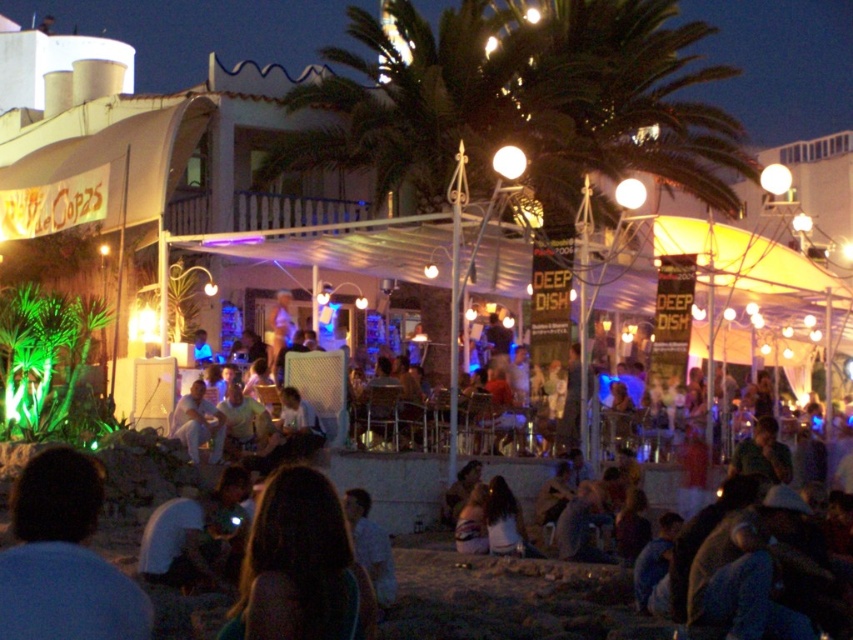
Question: Does blue fabric shirt at lower left have a larger size compared to dark brown hair at center?

Choices:
 (A) yes
 (B) no

Answer: (A)

Question: Which object is closer to the camera taking this photo?

Choices:
 (A) blue fabric shirt at lower left
 (B) dark brown hair at center

Answer: (A)

Question: Among these points, which one is farthest from the camera?

Choices:
 (A) (262, 604)
 (B) (36, 628)

Answer: (A)

Question: Which of the following is the farthest from the observer?

Choices:
 (A) blue fabric shirt at lower left
 (B) dark brown hair at center

Answer: (B)

Question: Does blue fabric shirt at lower left appear on the right side of dark brown hair at center?

Choices:
 (A) yes
 (B) no

Answer: (B)

Question: Does blue fabric shirt at lower left lie in front of dark brown hair at center?

Choices:
 (A) yes
 (B) no

Answer: (A)